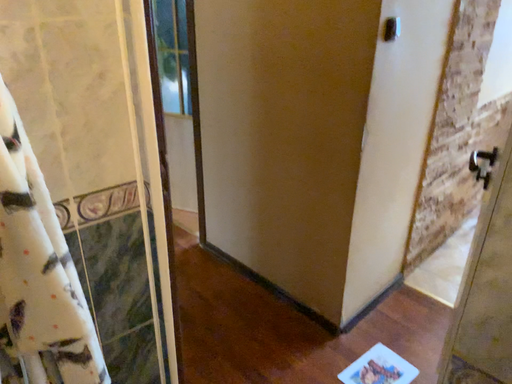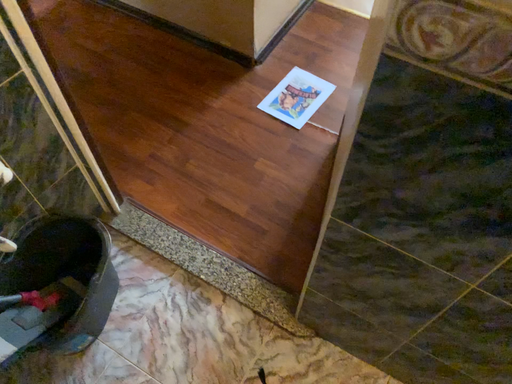
Question: How did the camera likely rotate when shooting the video?

Choices:
 (A) rotated left
 (B) rotated right

Answer: (B)